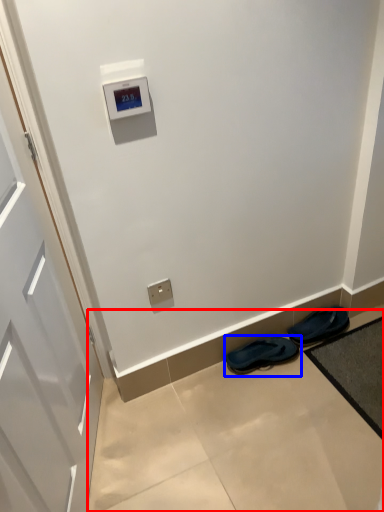
Question: Which object appears closest to the camera in this image, concrete (highlighted by a red box) or footwear (highlighted by a blue box)?

Choices:
 (A) concrete
 (B) footwear

Answer: (A)